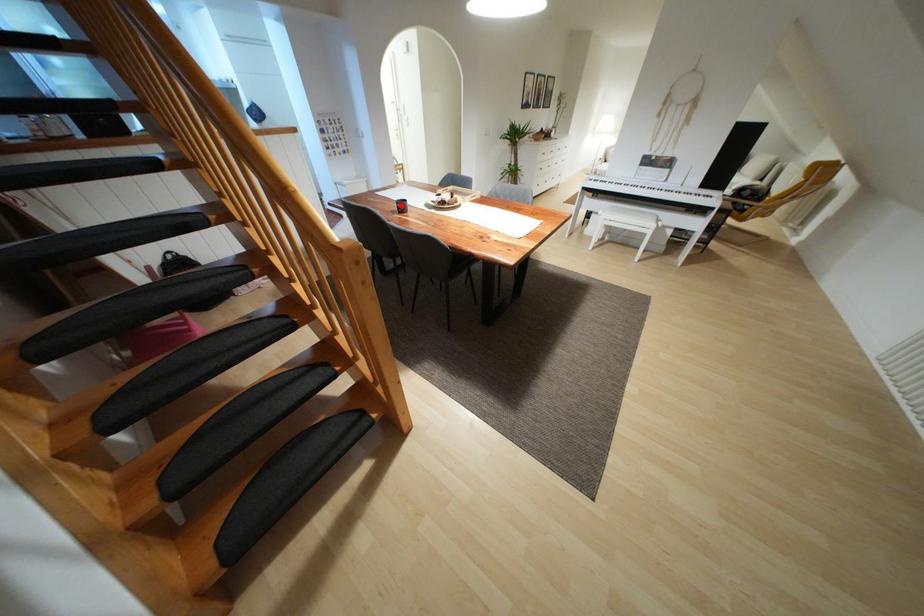
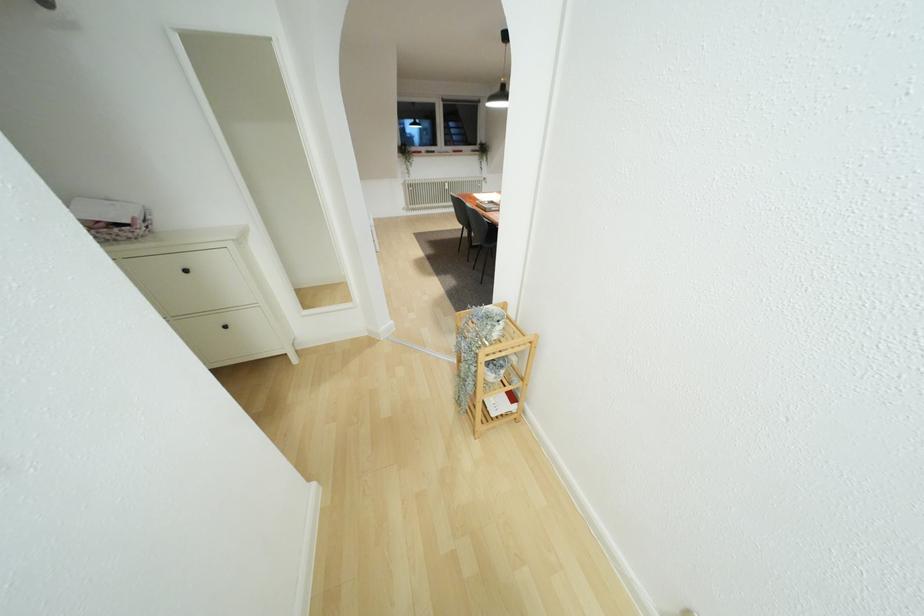
Question: I am providing you with two images of the same scene from different viewpoints. A red point is marked on the first image. Is the red point's position out of view in image 2?

Choices:
 (A) Yes
 (B) No

Answer: (A)